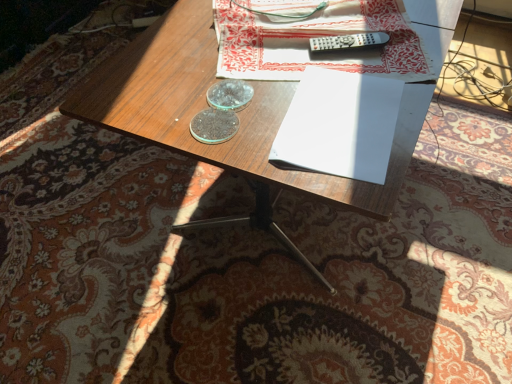
Question: Is wooden desk at center bigger or smaller than white paper at upper center?

Choices:
 (A) small
 (B) big

Answer: (B)

Question: Is point (435, 8) positioned closer to the camera than point (247, 26)?

Choices:
 (A) closer
 (B) farther

Answer: (B)

Question: Estimate the real-world distances between objects in this image. Which object is closer to the white paper at upper center?

Choices:
 (A) wooden desk at center
 (B) white paper at center
 (C) black plastic remote at upper center

Answer: (C)

Question: Based on their relative distances, which object is farther from the white paper at center?

Choices:
 (A) black plastic remote at upper center
 (B) white paper at upper center
 (C) wooden desk at center

Answer: (A)